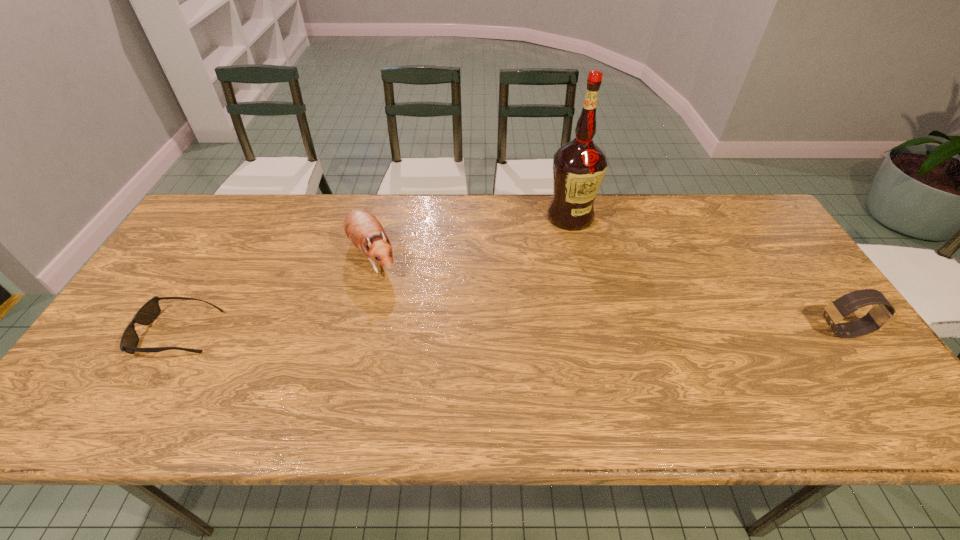
Locate an element on the screen. The width and height of the screenshot is (960, 540). vacant space on the desktop that is between the leftmost object and the rightmost object and is positioned on the label of the alcohol is located at coordinates (525, 332).

Locate an element on the screen. The height and width of the screenshot is (540, 960). free spot on the desktop that is between the leftmost object and the rightmost object and is positioned at the face of the third object from right to left is located at coordinates (414, 332).